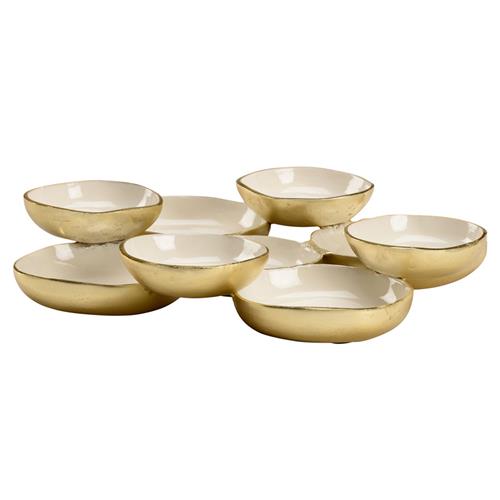
At what (x,y) coordinates should I click in order to perform the action: click on top bowls. Please return your answer as a coordinate pair (x, y). The width and height of the screenshot is (500, 500). Looking at the image, I should click on (72, 206), (302, 203), (183, 263), (414, 259).